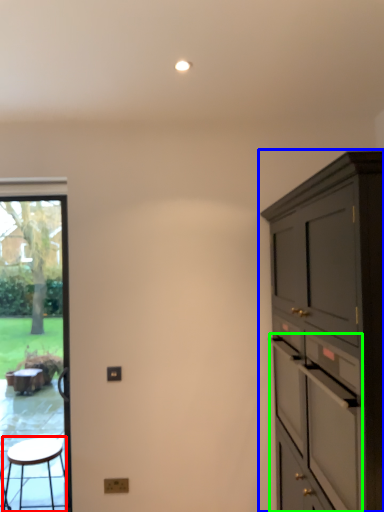
Question: Which is farther away from stool (highlighted by a red box)? cabinetry (highlighted by a blue box) or drawer (highlighted by a green box)?

Choices:
 (A) cabinetry
 (B) drawer

Answer: (A)